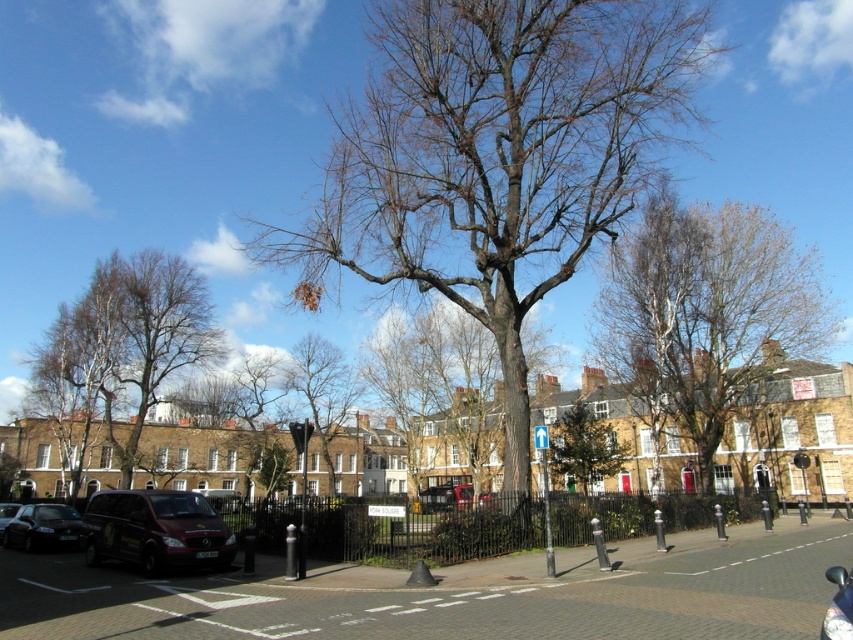
You are a painter who wants to paint the scene. You have a canvas that can only accommodate objects up to 2 meters in width. The bare wood tree at center and the bare branches at center are both in your view. Which object should you choose to fit on your canvas?

The bare branches at center should be chosen because the bare wood tree at center is wider than the branches, and the canvas can only accommodate up to 2 meters. Since the tree is wider than the branches, if the tree exceeds 2 meters, the branches might still fit. However, without exact measurements, the safer choice is the narrower one, which is the bare branches at center.

You are standing at the point marked as point (497, 156) in the image. What object is exactly at your current location?

The bare wood tree at center is located at point (497, 156).